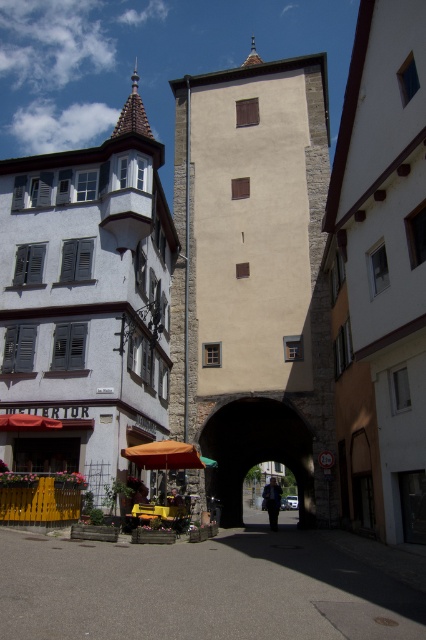
Between beige stone tower at center and stone archway at center, which one is positioned higher?

beige stone tower at center is above.

Is beige stone tower at center below stone archway at center?

No, beige stone tower at center is not below stone archway at center.

Image resolution: width=426 pixels, height=640 pixels. What do you see at coordinates (253, 275) in the screenshot?
I see `beige stone tower at center` at bounding box center [253, 275].

Identify the location of beige stone tower at center. This screenshot has height=640, width=426. (253, 275).

Based on the photo, how distant is beige stone tower at center from golden hair at center?

The distance of beige stone tower at center from golden hair at center is 53.12 feet.

Is beige stone tower at center further to the viewer compared to golden hair at center?

Yes, beige stone tower at center is further from the viewer.

Who is more distant from viewer, (273, 241) or (172, 493)?

The point (273, 241) is behind.

Locate an element on the screen. beige stone tower at center is located at coordinates (253, 275).

Does gray concrete alley at center have a greater height compared to stone archway at center?

No.

Is gray concrete alley at center closer to camera compared to stone archway at center?

Yes.

This screenshot has width=426, height=640. I want to click on gray concrete alley at center, so click(199, 589).